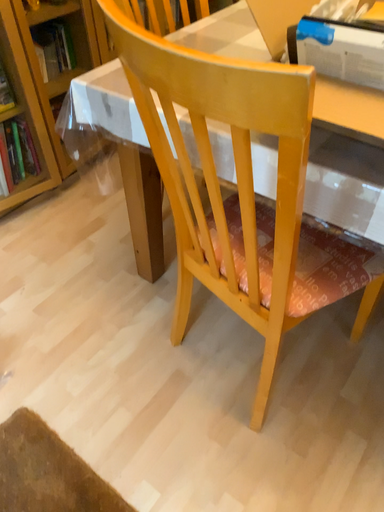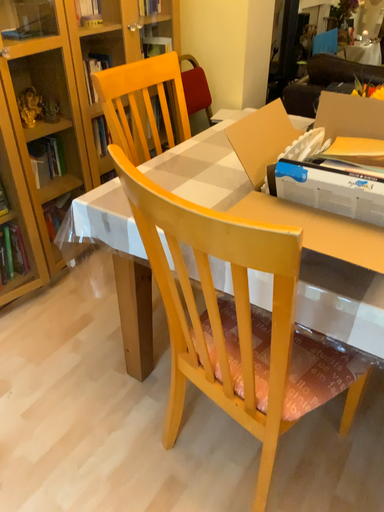
Question: Which way did the camera rotate in the video?

Choices:
 (A) rotated upward
 (B) rotated downward

Answer: (A)